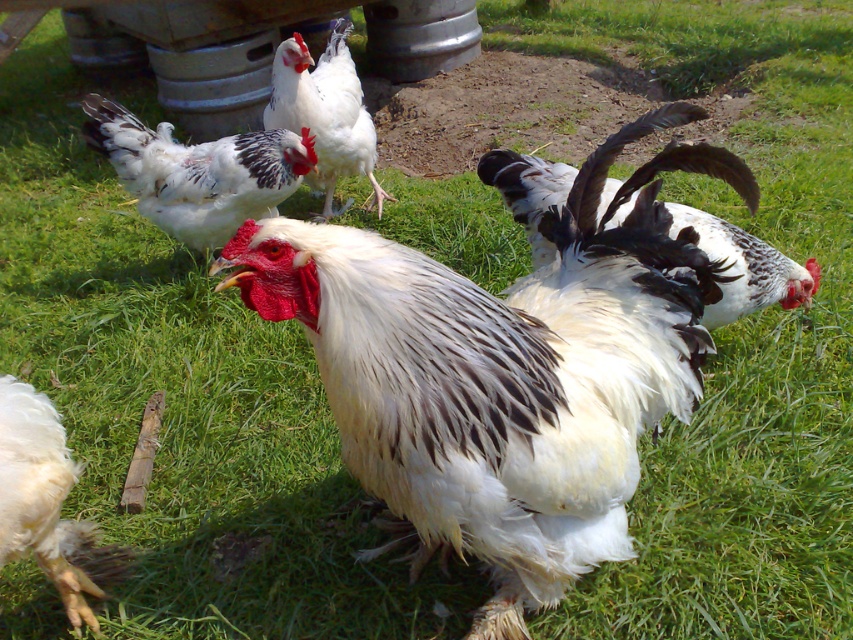
You are a farmer observing the chickens in the scene. You notice a white fluffy chicken at center and a white fluffy feather at lower left. Which object is positioned higher in the image?

The white fluffy chicken at center is positioned higher than the white fluffy feather at lower left.

You are a farmer checking the coop and notice a white fluffy feather at lower left and a white fluffy chicken at upper center. Which object is wider?

The white fluffy chicken at upper center is wider than the white fluffy feather at lower left.

Based on the scene description, where is the white glossy rooster at center located in the image?

The white glossy rooster at center is located at point (746, 268) in the image.